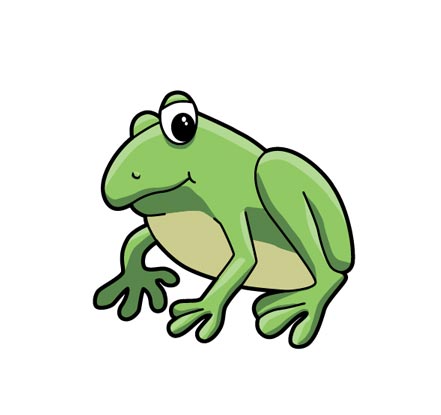
At what (x,y) coordinates should I click in order to perform the action: click on art work. Please return your answer as a coordinate pair (x, y). This screenshot has height=415, width=441. Looking at the image, I should click on (151, 176).